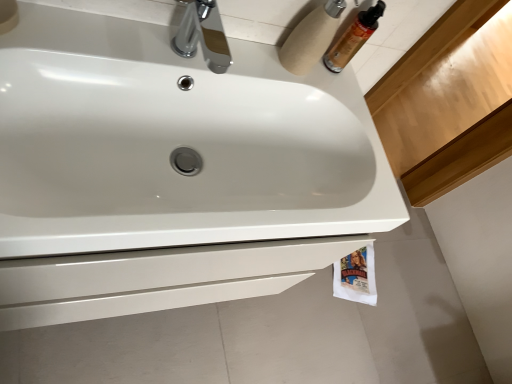
Find the location of `free space underneath white glossy sink at center (from a real-world perspective)`. free space underneath white glossy sink at center (from a real-world perspective) is located at coordinates (201, 154).